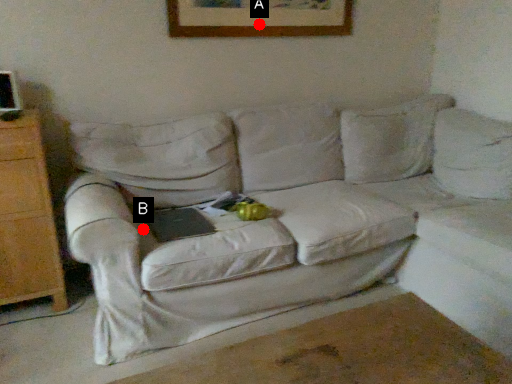
Question: Two points are circled on the image, labeled by A and B beside each circle. Which point is further to the camera?

Choices:
 (A) A is further
 (B) B is further

Answer: (A)